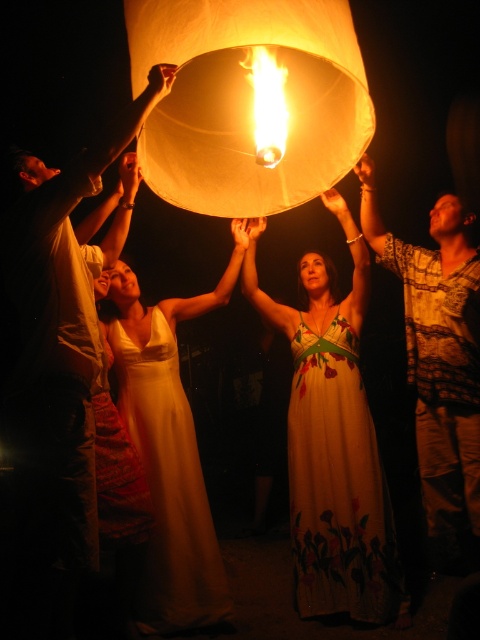
Measure the distance between point (169, 486) and camera.

The distance of point (169, 486) from camera is 10.33 feet.

Describe the element at coordinates (168, 484) in the screenshot. I see `satin gold dress at center` at that location.

Identify the location of satin gold dress at center. This screenshot has width=480, height=640. (168, 484).

Between transparent paper lantern at center and printed cotton shirt at upper right, which one has less height?

transparent paper lantern at center is shorter.

Is point (228, 113) positioned in front of point (463, 260)?

Yes, point (228, 113) is in front of point (463, 260).

This screenshot has width=480, height=640. Find the location of `transparent paper lantern at center`. transparent paper lantern at center is located at coordinates (248, 100).

Does transparent paper lantern at center lie behind white floral dress at center?

That is False.

At what (x,y) coordinates should I click in order to perform the action: click on transparent paper lantern at center. Please return your answer as a coordinate pair (x, y). This screenshot has width=480, height=640. Looking at the image, I should click on (248, 100).